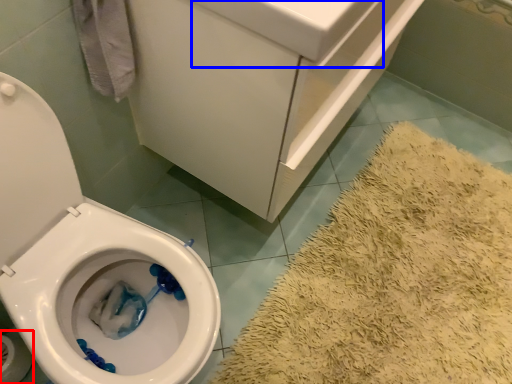
Question: Among these objects, which one is farthest to the camera, toilet paper (highlighted by a red box) or sink (highlighted by a blue box)?

Choices:
 (A) toilet paper
 (B) sink

Answer: (A)